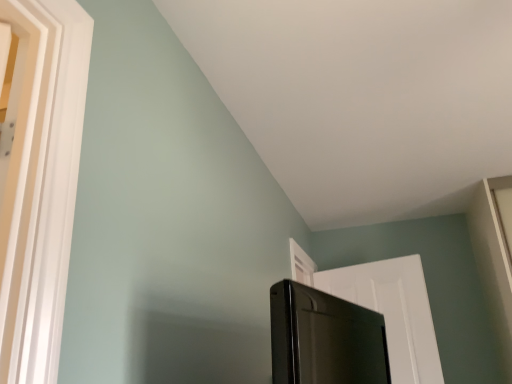
Question: From a real-world perspective, relative to black glossy screen door at lower right, is white matte door at upper right vertically above or below?

Choices:
 (A) above
 (B) below

Answer: (A)

Question: From the image's perspective, is white matte door at upper right located above or below black glossy screen door at lower right?

Choices:
 (A) above
 (B) below

Answer: (B)

Question: Choose the correct answer: Is white matte door at upper right inside black glossy screen door at lower right or outside it?

Choices:
 (A) inside
 (B) outside

Answer: (B)

Question: Is point (348, 354) positioned closer to the camera than point (401, 360)?

Choices:
 (A) farther
 (B) closer

Answer: (B)

Question: From the image's perspective, is black glossy screen door at lower right above or below white matte door at upper right?

Choices:
 (A) above
 (B) below

Answer: (A)

Question: Based on their positions, is black glossy screen door at lower right located to the left or right of white matte door at upper right?

Choices:
 (A) right
 (B) left

Answer: (B)

Question: Considering the positions of black glossy screen door at lower right and white matte door at upper right in the image, is black glossy screen door at lower right bigger or smaller than white matte door at upper right?

Choices:
 (A) big
 (B) small

Answer: (B)